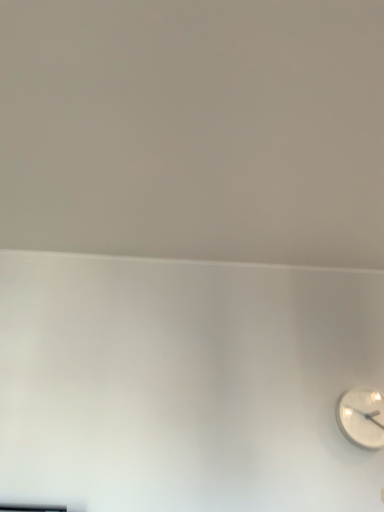
This screenshot has height=512, width=384. What are the coordinates of `white glossy wall clock at lower right` in the screenshot? It's located at (362, 417).

Describe the element at coordinates (362, 417) in the screenshot. This screenshot has height=512, width=384. I see `white glossy wall clock at lower right` at that location.

The image size is (384, 512). What are the coordinates of `white glossy wall clock at lower right` in the screenshot? It's located at (362, 417).